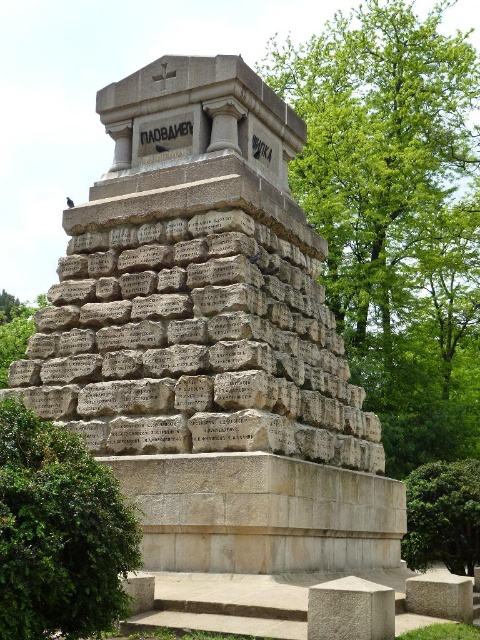
You are a visitor standing at the base of the monument. You notice a green leafy bush at lower left and a green leafy tree at lower right. Which of these two plants is taller?

The green leafy tree at lower right is taller than the green leafy bush at lower left.

You are a photographer standing in front of the granite stone monument at center and the green leafy bush at lower left. You want to take a photo that includes both objects but focuses on the monument. Which object should you move closer to, and why?

You should move closer to the green leafy bush at lower left because the granite stone monument at center is already closer to you than the green leafy bush at lower left. By moving closer to the bush, you can ensure both objects are in frame while keeping the monument as the main focus.

You are a visitor standing in front of the monument and notice the green leafy bush at lower left and the green leafy tree at lower right. Which one takes up more space in the image?

The green leafy tree at lower right takes up more space in the image than the green leafy bush at lower left.